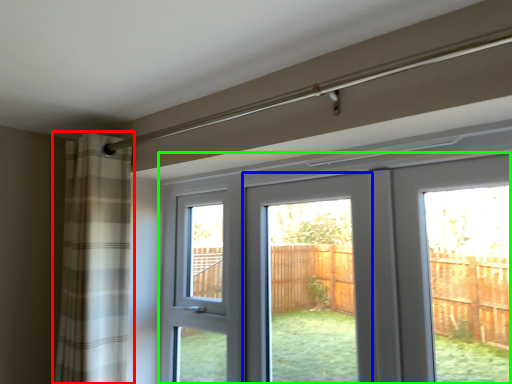
Question: Based on their relative distances, which object is farther from curtain (highlighted by a red box)? Choose from screen door (highlighted by a blue box) and door (highlighted by a green box).

Choices:
 (A) screen door
 (B) door

Answer: (B)